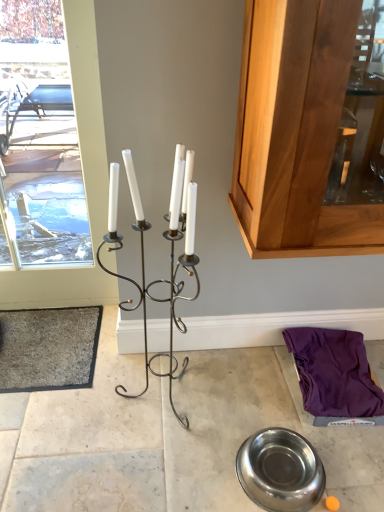
This screenshot has height=512, width=384. What are the coordinates of `vacant location below polished stainless steel bowl at lower center (from a real-world perspective)` in the screenshot? It's located at (279, 470).